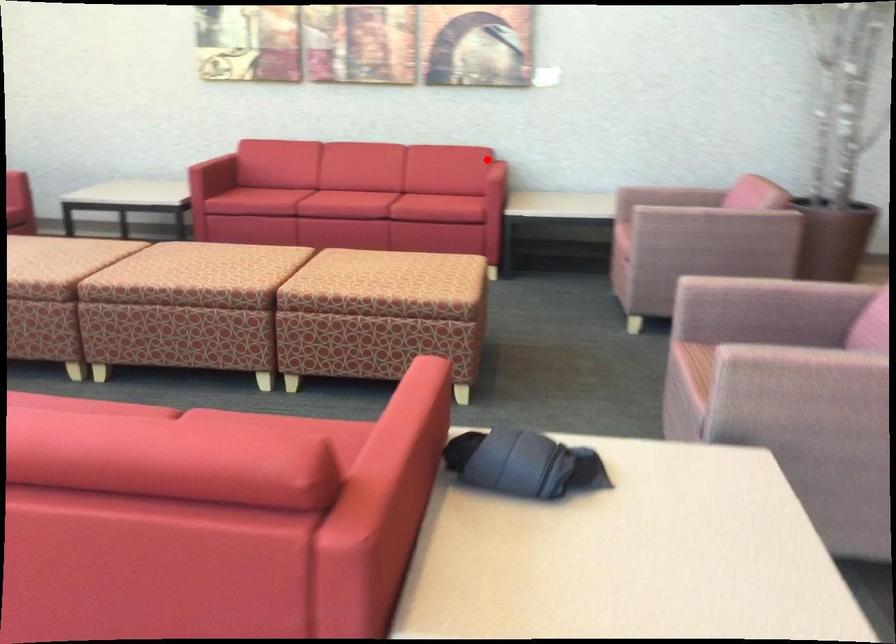
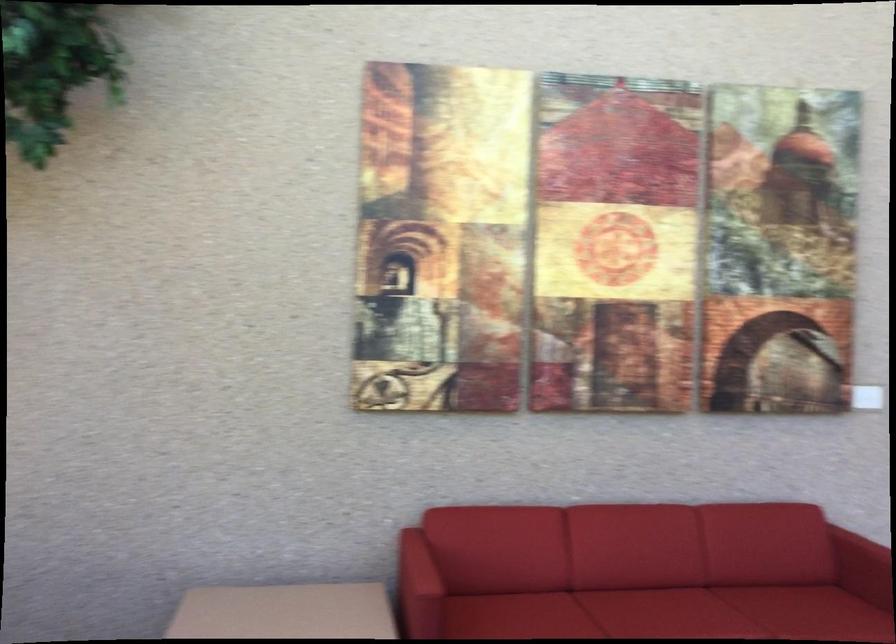
Question: I am providing you with two images of the same scene from different viewpoints. In image1, a red point is highlighted. Considering the same 3D point in image2, which of the following is correct?

Choices:
 (A) It is closer
 (B) It is farther

Answer: (A)